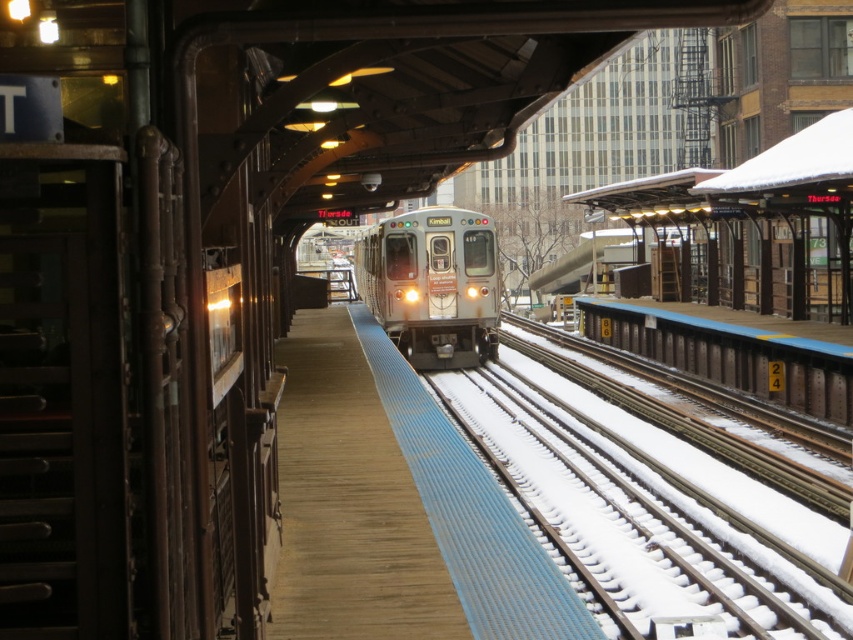
Does wooden platform at center have a lesser height compared to silver metallic train at center?

Yes.

Between wooden platform at center and silver metallic train at center, which one is positioned higher?

silver metallic train at center is higher up.

The width and height of the screenshot is (853, 640). What do you see at coordinates (349, 502) in the screenshot?
I see `wooden platform at center` at bounding box center [349, 502].

Identify the location of wooden platform at center. (349, 502).